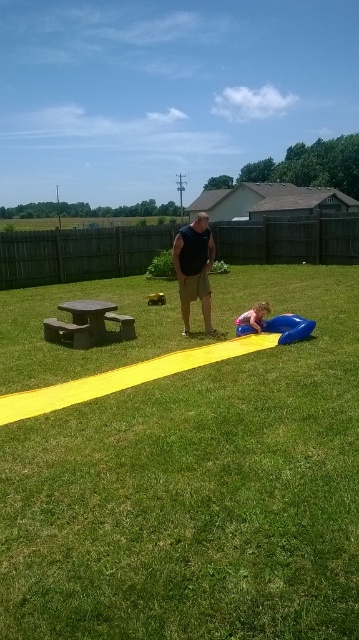
You are a parent trying to decide where to place a new small toy for your child. The toy is 10 inches tall. You have two options in the backyard scene shown. The options are the gray concrete picnic table at left and the smooth pink ball at lower center. Which object can the toy be placed on without it being too unstable?

The gray concrete picnic table at left is taller than the smooth pink ball at lower center. Since the toy is 10 inches tall, placing it on the taller picnic table would provide a more stable surface compared to the smaller pink ball, which might cause instability due to its lower height.